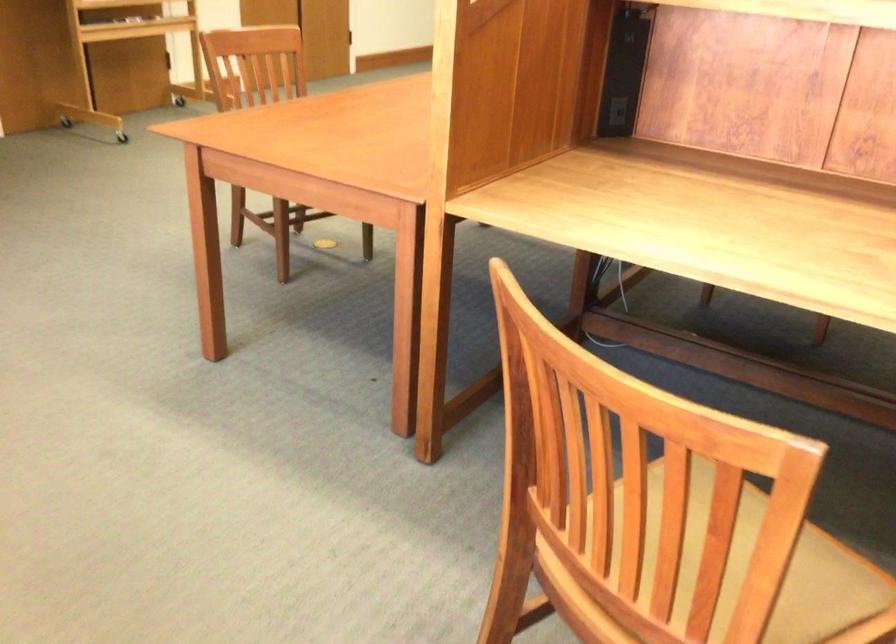
The width and height of the screenshot is (896, 644). What do you see at coordinates (616, 111) in the screenshot? I see `the black power outlet` at bounding box center [616, 111].